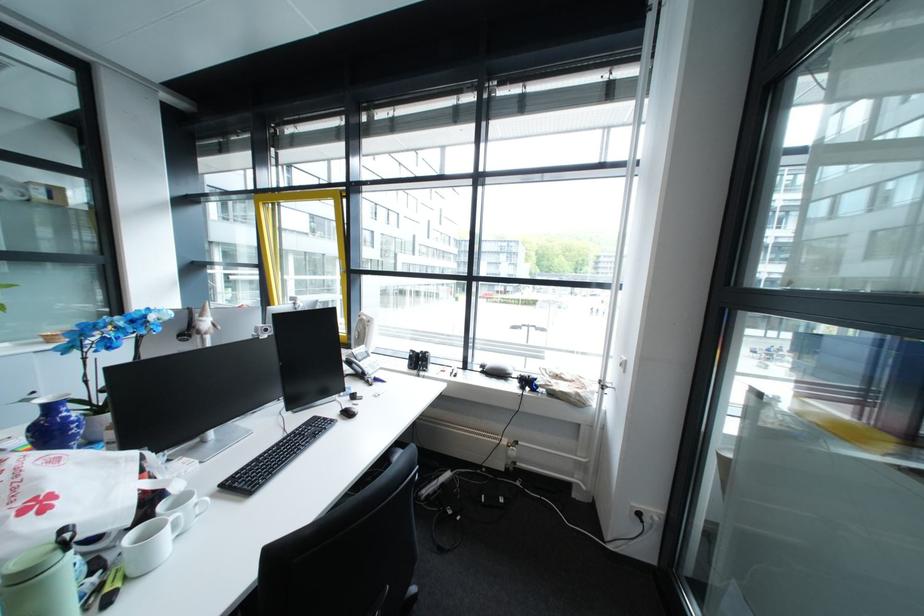
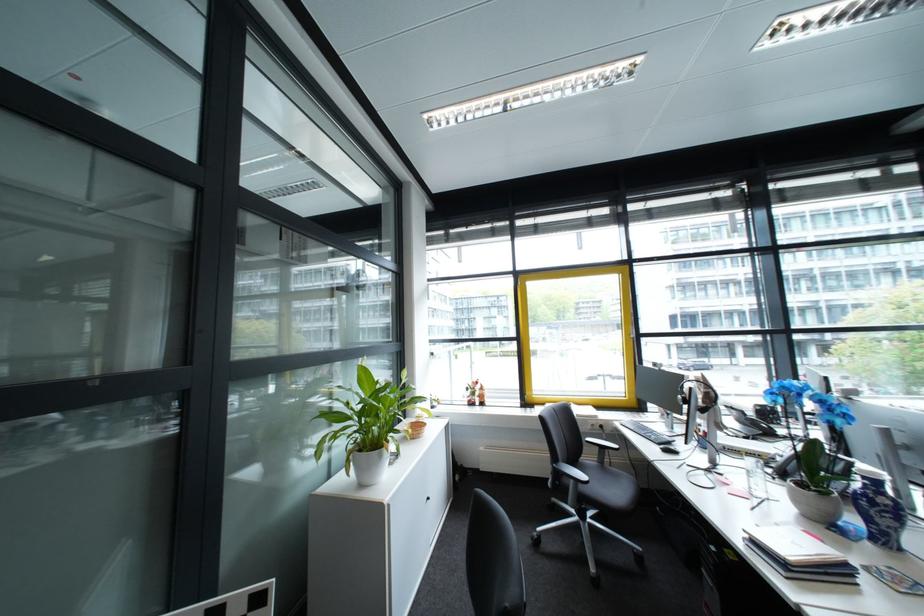
Question: Which direction would the cameraman need to move to produce the second image? Reply with the corresponding letter.

Choices:
 (A) Left
 (B) Right
 (C) Forward
 (D) Backward

Answer: (A)